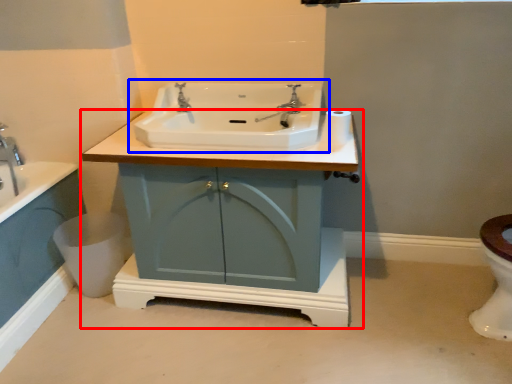
Question: Which object is further to the camera taking this photo, bathroom cabinet (highlighted by a red box) or sink (highlighted by a blue box)?

Choices:
 (A) bathroom cabinet
 (B) sink

Answer: (B)